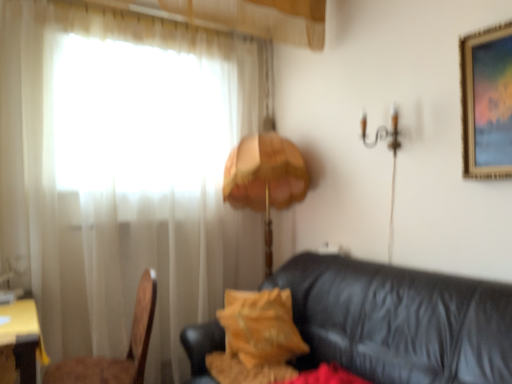
Describe the element at coordinates (265, 179) in the screenshot. I see `orange fabric lampshade at center` at that location.

Where is `white sheer curtain at left`? white sheer curtain at left is located at coordinates (124, 173).

Measure the distance between point (x=239, y=336) and camera.

Point (x=239, y=336) and camera are 7.01 feet apart from each other.

The image size is (512, 384). In order to click on black leather couch at lower right in this screenshot , I will do `click(398, 321)`.

Where is `orange fabric lampshade at center`? orange fabric lampshade at center is located at coordinates [265, 179].

Is yellow wood table at lower left situated inside white sheer curtain at left or outside?

yellow wood table at lower left is not enclosed by white sheer curtain at left.

Is yellow wood table at lower left wider or thinner than white sheer curtain at left?

In the image, yellow wood table at lower left appears to be wider than white sheer curtain at left.

Can you tell me how much yellow wood table at lower left and white sheer curtain at left differ in facing direction?

There is a 9.5-degree angle between the facing directions of yellow wood table at lower left and white sheer curtain at left.

You are a GUI agent. You are given a task and a screenshot of the screen. Output one action in this format:
    pyautogui.click(x=<x>, y=<y>)
    Task: Click on the curtain on the right side of yellow wood table at lower left
    This screenshot has width=512, height=384.
    Given the screenshot: What is the action you would take?
    pyautogui.click(x=124, y=173)

From a real-world perspective, is black leather couch at lower right beneath white sheer curtain at left?

Yes.

Considering the relative positions of black leather couch at lower right and white sheer curtain at left in the image provided, is black leather couch at lower right to the left or to the right of white sheer curtain at left?

black leather couch at lower right is to the right of white sheer curtain at left.

Can you confirm if black leather couch at lower right is thinner than white sheer curtain at left?

No, black leather couch at lower right is not thinner than white sheer curtain at left.

Which is correct: black leather couch at lower right is inside white sheer curtain at left, or outside of it?

black leather couch at lower right is not inside white sheer curtain at left, it's outside.

Is white sheer curtain at left far from yellow wood table at lower left?

white sheer curtain at left is far away from yellow wood table at lower left.

What's the angular difference between white sheer curtain at left and yellow wood table at lower left's facing directions?

They differ by 9.5 degrees in their facing directions.

Considering their positions, is white sheer curtain at left located in front of or behind yellow wood table at lower left?

In the image, white sheer curtain at left appears behind yellow wood table at lower left.

Is white sheer curtain at left oriented towards yellow wood table at lower left?

Yes, white sheer curtain at left faces towards yellow wood table at lower left.

Is white sheer curtain at left not within wooden chair at left?

Yes, white sheer curtain at left is not within wooden chair at left.

From the image's perspective, which object appears higher, white sheer curtain at left or wooden chair at left?

white sheer curtain at left appears higher in the image.

Between white sheer curtain at left and wooden chair at left, which one appears on the left side from the viewer's perspective?

From the viewer's perspective, wooden chair at left appears more on the left side.

Are white sheer curtain at left and wooden chair at left far apart?

Actually, white sheer curtain at left and wooden chair at left are a little close together.

Considering the relative positions of black leather couch at lower right and yellow wood table at lower left in the image provided, is black leather couch at lower right in front of yellow wood table at lower left?

Yes, black leather couch at lower right is in front of yellow wood table at lower left.

Is black leather couch at lower right not close to yellow wood table at lower left?

Yes, black leather couch at lower right and yellow wood table at lower left are quite far apart.

Which is more to the right, black leather couch at lower right or yellow wood table at lower left?

black leather couch at lower right.

From the image's perspective, which one is positioned higher, white sheer curtain at left or velvet yellow pillow at center?

white sheer curtain at left, from the image's perspective.

How many degrees apart are the facing directions of white sheer curtain at left and velvet yellow pillow at center?

There is a 18.9-degree angle between the facing directions of white sheer curtain at left and velvet yellow pillow at center.

Is velvet yellow pillow at center surrounded by white sheer curtain at left?

No, white sheer curtain at left does not contain velvet yellow pillow at center.

Considering their positions, is white sheer curtain at left located in front of or behind velvet yellow pillow at center?

white sheer curtain at left is in front of velvet yellow pillow at center.

Can you see black leather couch at lower right touching orange fabric lampshade at center?

There is a gap between black leather couch at lower right and orange fabric lampshade at center.

Is black leather couch at lower right positioned with its back to orange fabric lampshade at center?

No, black leather couch at lower right is not facing away from orange fabric lampshade at center.

From a real-world perspective, is black leather couch at lower right above or below orange fabric lampshade at center?

black leather couch at lower right is situated lower than orange fabric lampshade at center in the real world.

This screenshot has width=512, height=384. Find the location of `table located in front of the white sheer curtain at left`. table located in front of the white sheer curtain at left is located at coordinates (19, 341).

Where is `studio couch below the white sheer curtain at left (from the image's perspective)`? The image size is (512, 384). studio couch below the white sheer curtain at left (from the image's perspective) is located at coordinates (398, 321).

From the image, which object appears to be farther from orange fabric lampshade at center, black leather couch at lower right or wooden chair at left?

wooden chair at left lies further to orange fabric lampshade at center than the other object.

Which object lies further to the anchor point wooden chair at left, velvet yellow pillow at center or white sheer curtain at left?

The object further to wooden chair at left is white sheer curtain at left.

Looking at the image, which one is located closer to black leather couch at lower right, orange fabric lampshade at center or wooden chair at left?

orange fabric lampshade at center is positioned closer to the anchor black leather couch at lower right.

Looking at the image, which one is located closer to orange fabric lampshade at center, white sheer curtain at left or wooden chair at left?

Among the two, white sheer curtain at left is located nearer to orange fabric lampshade at center.

Based on their spatial positions, is white sheer curtain at left or yellow wood table at lower left closer to black leather couch at lower right?

white sheer curtain at left lies closer to black leather couch at lower right than the other object.

From the image, which object appears to be nearer to wooden chair at left, white sheer curtain at left or yellow wood table at lower left?

yellow wood table at lower left is closer to wooden chair at left.

Looking at the image, which one is located closer to velvet yellow pillow at center, orange fabric lampshade at center or white sheer curtain at left?

Among the two, orange fabric lampshade at center is located nearer to velvet yellow pillow at center.

Looking at the image, which one is located further to velvet yellow pillow at center, wooden chair at left or yellow wood table at lower left?

Among the two, yellow wood table at lower left is located further to velvet yellow pillow at center.

You are a GUI agent. You are given a task and a screenshot of the screen. Output one action in this format:
    pyautogui.click(x=<x>, y=<y>)
    Task: Click on the curtain between wooden chair at left and orange fabric lampshade at center in the horizontal direction
    
    Given the screenshot: What is the action you would take?
    pyautogui.click(x=124, y=173)

I want to click on pillow between black leather couch at lower right and orange fabric lampshade at center in the front-back direction, so click(x=261, y=327).

Where is `table between white sheer curtain at left and wooden chair at left vertically`? table between white sheer curtain at left and wooden chair at left vertically is located at coordinates (19, 341).

Where is `curtain between wooden chair at left and velvet yellow pillow at center`? curtain between wooden chair at left and velvet yellow pillow at center is located at coordinates (124, 173).